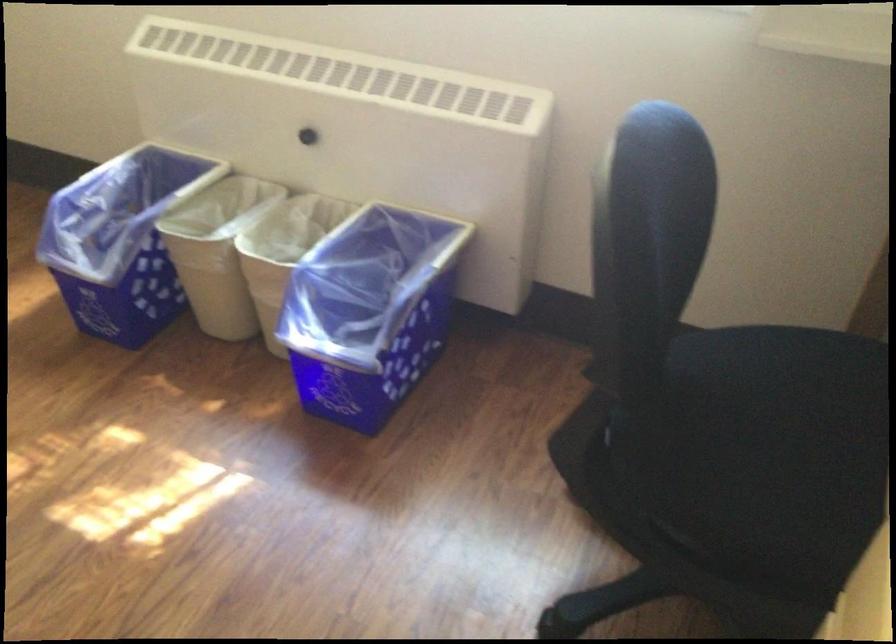
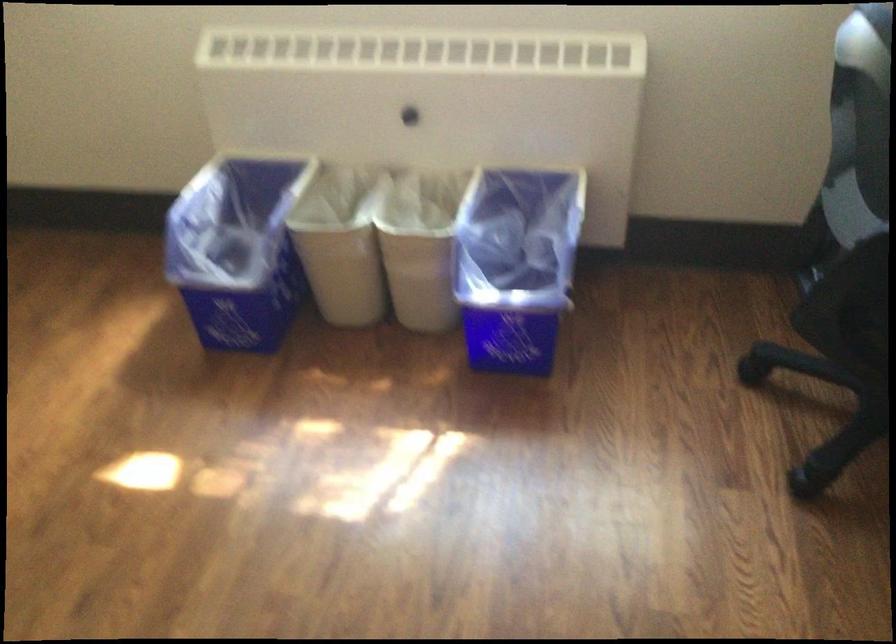
Find the pixel in the second image that matches pixel 380 310 in the first image.

(515, 265)